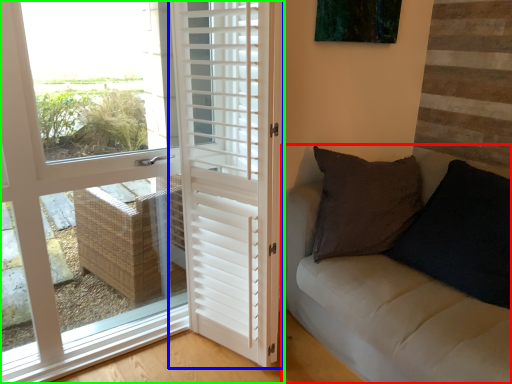
Question: Estimate the real-world distances between objects in this image. Which object is farther from studio couch (highlighted by a red box), door (highlighted by a blue box) or door (highlighted by a green box)?

Choices:
 (A) door
 (B) door

Answer: (B)